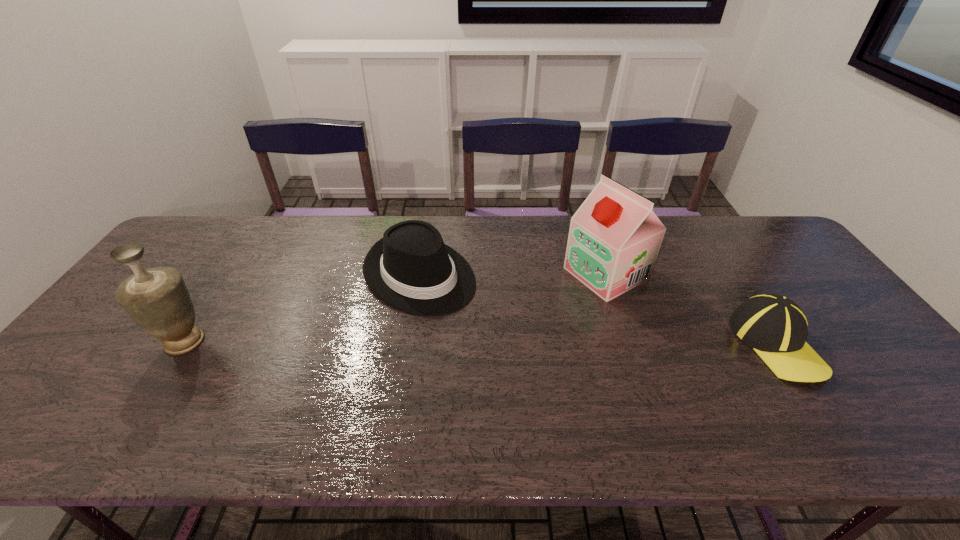
Find the location of a particular element. blank region between the shortest object and the second shortest object is located at coordinates (597, 309).

Where is `free spot between the urn and the fedora`? Image resolution: width=960 pixels, height=540 pixels. free spot between the urn and the fedora is located at coordinates (301, 308).

Identify which object is the third nearest to the shortest object. Please provide its 2D coordinates. Your answer should be formatted as a tuple, i.e. [(x, y)], where the tuple contains the x and y coordinates of a point satisfying the conditions above.

[(157, 299)]

Locate an element on the screen. This screenshot has height=540, width=960. the second closest object to the third tallest object is located at coordinates (157, 299).